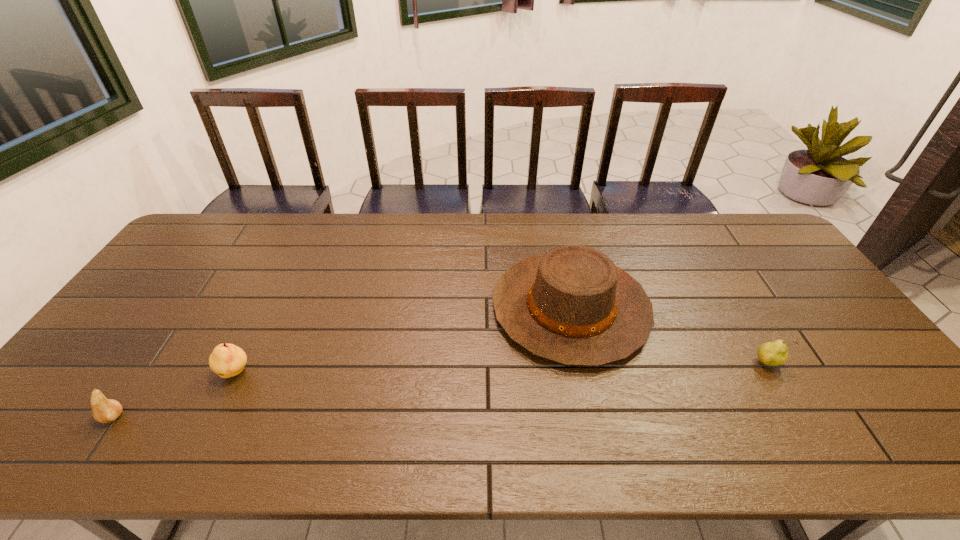
Find the location of a particular element. blank region between the tallest object and the leftmost pear is located at coordinates (342, 363).

Find the location of `free space that is in between the second pear from right to left and the rightmost object`. free space that is in between the second pear from right to left and the rightmost object is located at coordinates (501, 368).

Identify the location of vacant region between the rightmost object and the cowboy hat. click(x=668, y=336).

The width and height of the screenshot is (960, 540). I want to click on vacant space that's between the second pear from left to right and the second object from right to left, so click(x=403, y=341).

Image resolution: width=960 pixels, height=540 pixels. What are the coordinates of `blank region between the tallest object and the leftmost pear` in the screenshot? It's located at tap(342, 363).

Find the location of a particular element. This screenshot has height=540, width=960. vacant area that lies between the third object from left to right and the leftmost pear is located at coordinates (342, 363).

This screenshot has height=540, width=960. I want to click on empty space between the nearest pear and the second pear from right to left, so point(175,395).

Where is `unoccupied area between the rightmost object and the third object from left to right`? Image resolution: width=960 pixels, height=540 pixels. unoccupied area between the rightmost object and the third object from left to right is located at coordinates 668,336.

Choose which object is the nearest neighbor to the cowboy hat. Please provide its 2D coordinates. Your answer should be formatted as a tuple, i.e. [(x, y)], where the tuple contains the x and y coordinates of a point satisfying the conditions above.

[(775, 353)]

The image size is (960, 540). What are the coordinates of `the second closest object relative to the second object from left to right` in the screenshot? It's located at (572, 306).